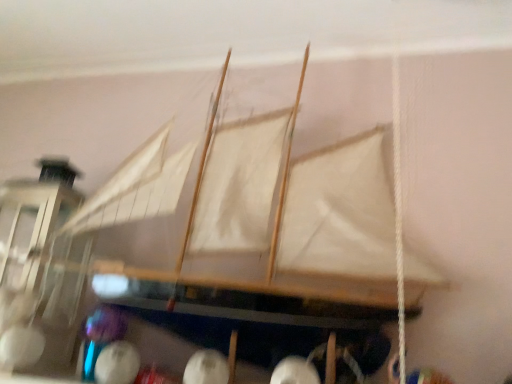
Describe the element at coordinates (31, 235) in the screenshot. The height and width of the screenshot is (384, 512). I see `brushed metal lantern at left` at that location.

This screenshot has width=512, height=384. Find the location of `brushed metal lantern at left`. brushed metal lantern at left is located at coordinates (31, 235).

Find the location of a particular element. This screenshot has width=512, height=384. brushed metal lantern at left is located at coordinates (31, 235).